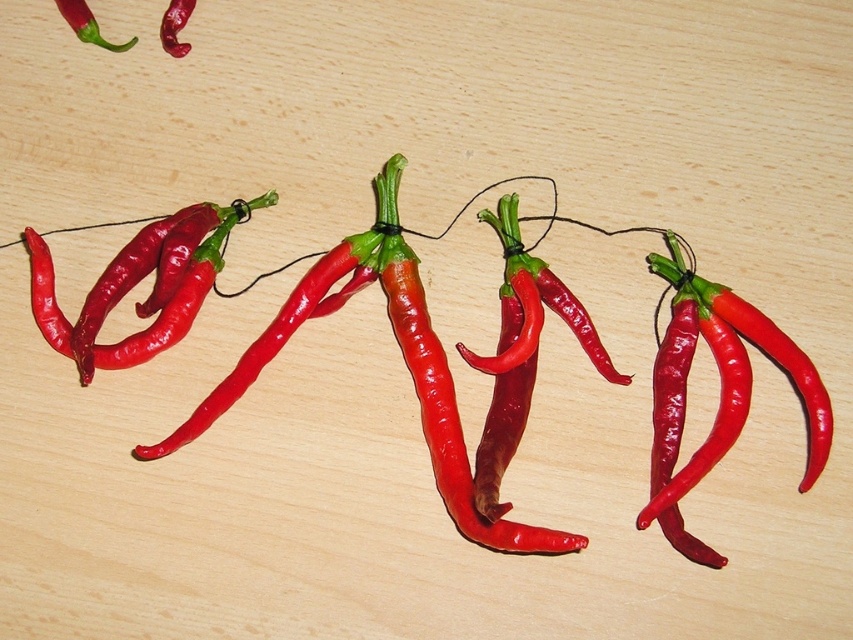
Question: Which point appears farthest from the camera in this image?

Choices:
 (A) (175, 6)
 (B) (68, 13)

Answer: (A)

Question: Which point is closer to the camera taking this photo?

Choices:
 (A) (78, 3)
 (B) (169, 8)

Answer: (A)

Question: Can you confirm if matte red pepper at upper left is positioned to the right of glossy red pepper at upper left?

Choices:
 (A) yes
 (B) no

Answer: (B)

Question: Does matte red pepper at upper left appear over glossy red pepper at upper left?

Choices:
 (A) no
 (B) yes

Answer: (A)

Question: Which point is farther to the camera?

Choices:
 (A) (173, 48)
 (B) (73, 6)

Answer: (A)

Question: Is matte red pepper at upper left thinner than glossy red pepper at upper left?

Choices:
 (A) yes
 (B) no

Answer: (B)